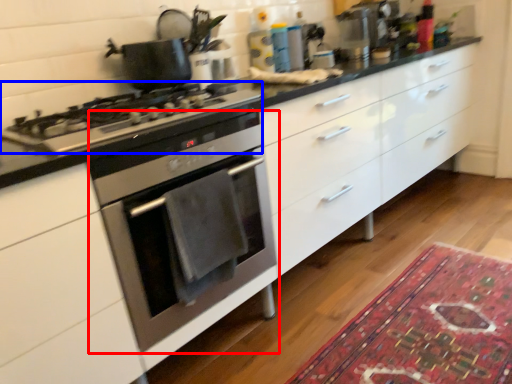
Question: Which point is further to the camera, oven (highlighted by a red box) or gas stove (highlighted by a blue box)?

Choices:
 (A) oven
 (B) gas stove

Answer: (A)